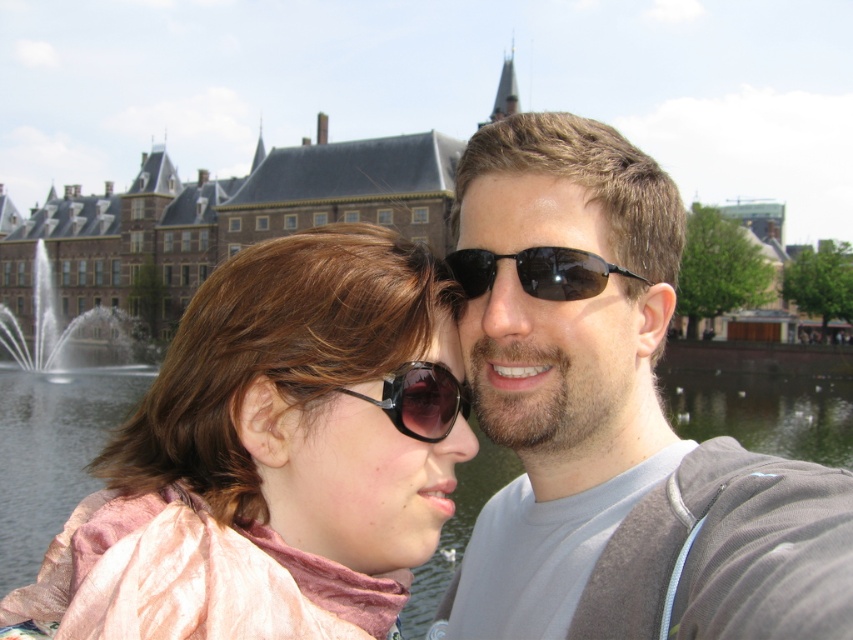
Question: Does transparent water at center have a lesser width compared to sunglasses at center?

Choices:
 (A) yes
 (B) no

Answer: (B)

Question: Which of the following is the farthest from the observer?

Choices:
 (A) silver metallic fountain at center
 (B) black reflective sunglasses at center
 (C) sunglasses at center

Answer: (A)

Question: Is matte gray hoodie at center behind pink fabric scarf at center?

Choices:
 (A) yes
 (B) no

Answer: (B)

Question: Estimate the real-world distances between objects in this image. Which object is farther from the sunglasses at center?

Choices:
 (A) black reflective sunglasses at center
 (B) silver metallic fountain at center

Answer: (B)

Question: Does matte gray hoodie at center lie behind sunglasses at center?

Choices:
 (A) no
 (B) yes

Answer: (A)

Question: Which point is farther from the camera taking this photo?

Choices:
 (A) (426, 385)
 (B) (488, 264)
 (C) (578, 216)
 (D) (0, 454)

Answer: (D)